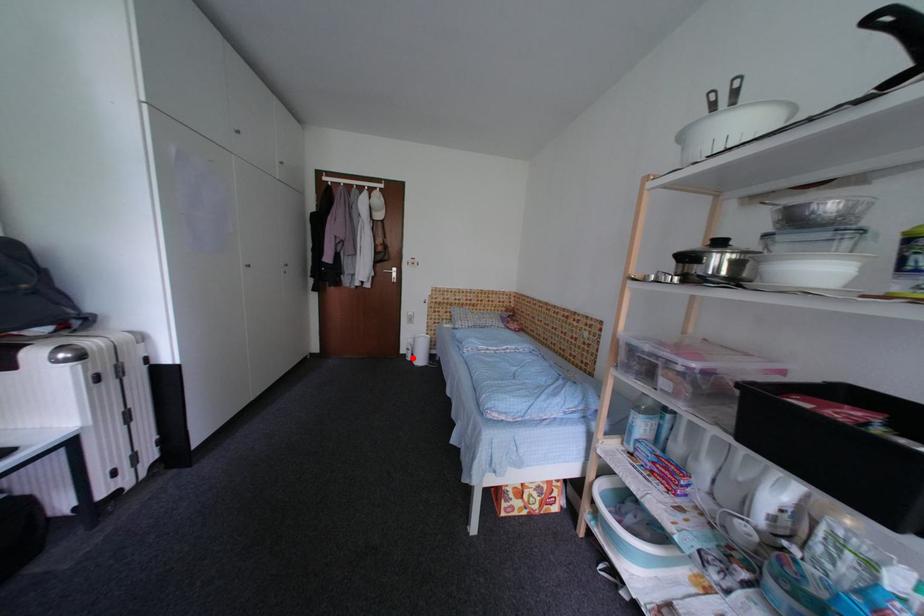
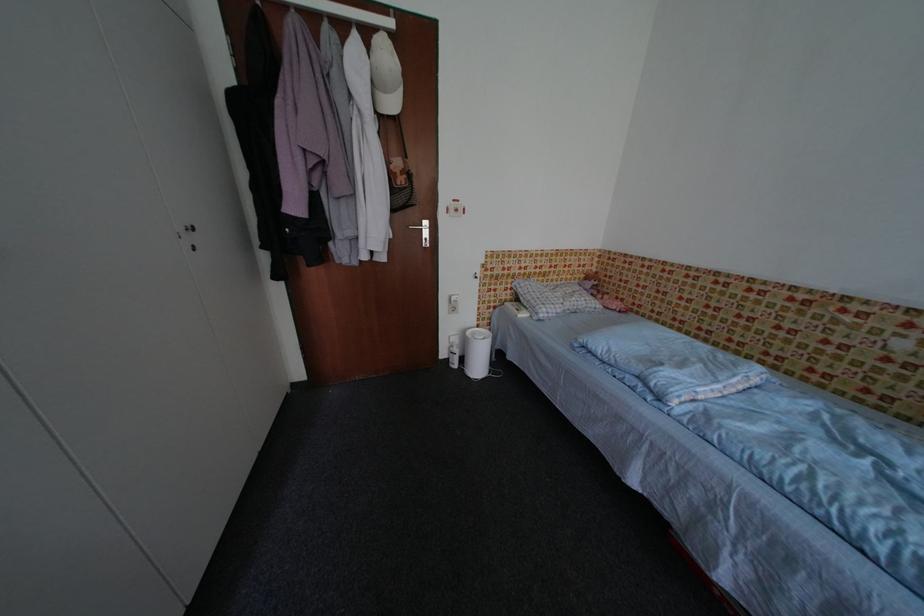
Question: I am providing you with two images of the same scene from different viewpoints. Given a red point in image1, look at the same physical point in image2. Is it:

Choices:
 (A) Closer to the viewpoint
 (B) Farther from the viewpoint

Answer: (A)